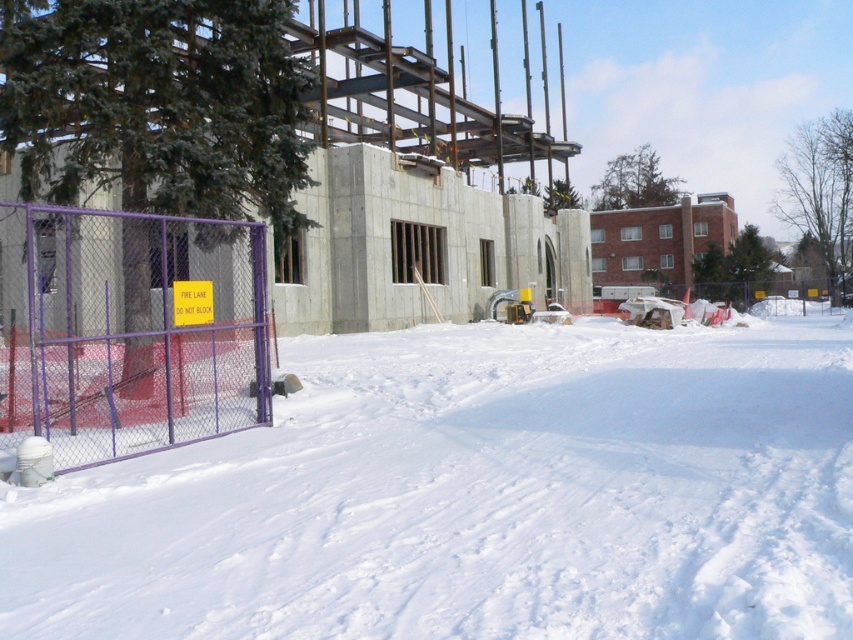
Question: Where is white powdery snow at left located in relation to purple chain-link fence at left in the image?

Choices:
 (A) right
 (B) left

Answer: (A)

Question: Which of the following is the closest to the observer?

Choices:
 (A) (149, 449)
 (B) (44, 577)

Answer: (B)

Question: Can you confirm if white powdery snow at left is positioned above purple chain-link fence at left?

Choices:
 (A) yes
 (B) no

Answer: (B)

Question: Does white powdery snow at left come in front of purple chain-link fence at left?

Choices:
 (A) yes
 (B) no

Answer: (A)

Question: Among these points, which one is nearest to the camera?

Choices:
 (A) (173, 224)
 (B) (485, 348)

Answer: (A)

Question: Among these objects, which one is nearest to the camera?

Choices:
 (A) white powdery snow at left
 (B) purple chain-link fence at left

Answer: (A)